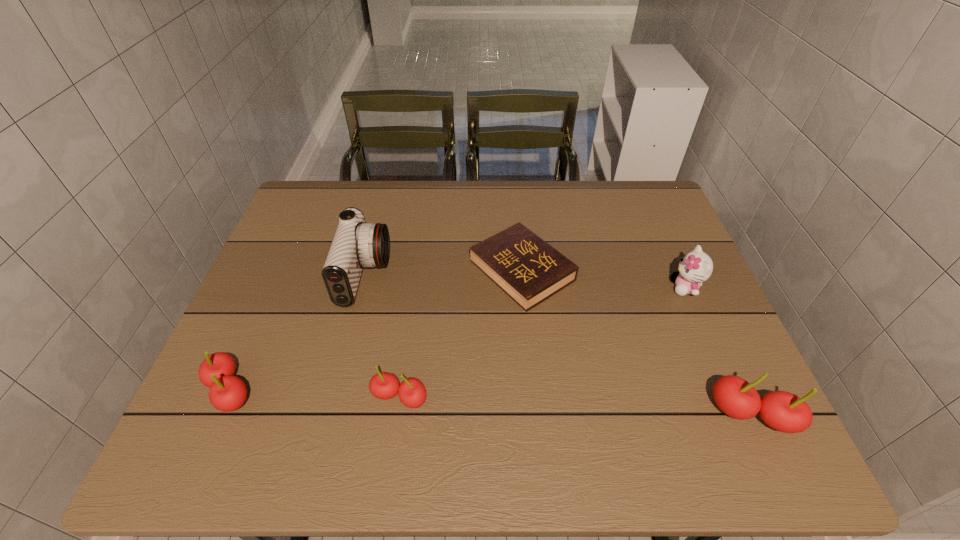
Locate an element on the screen. free location located on the left of the rightmost cherry is located at coordinates (643, 414).

I want to click on vacant space located 0.310m on the surface of the camcorder, so click(503, 275).

Locate an element on the screen. blank space located 0.180m on the front-facing side of the kitten is located at coordinates (602, 287).

At what (x,y) coordinates should I click in order to perform the action: click on vacant space located 0.100m on the front-facing side of the kitten. Please return your answer as a coordinate pair (x, y). The width and height of the screenshot is (960, 540). Looking at the image, I should click on (633, 287).

Locate an element on the screen. This screenshot has width=960, height=540. free space located 0.210m on the front-facing side of the kitten is located at coordinates (590, 287).

Identify the location of vacant space positioned on the back of the third object from right to left. This screenshot has height=540, width=960. (514, 183).

Identify the location of object that is at the left edge. This screenshot has width=960, height=540. (227, 393).

This screenshot has width=960, height=540. I want to click on cherry positioned at the right edge, so click(x=783, y=411).

Where is `kitten situated at the right edge`? Image resolution: width=960 pixels, height=540 pixels. kitten situated at the right edge is located at coordinates (696, 267).

The width and height of the screenshot is (960, 540). I want to click on object that is at the near left corner, so click(x=227, y=393).